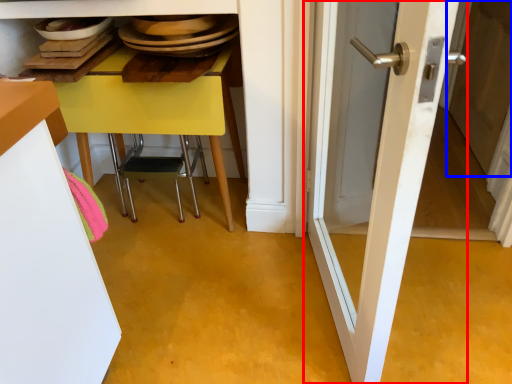
Question: Among these objects, which one is nearest to the camera, door (highlighted by a red box) or screen door (highlighted by a blue box)?

Choices:
 (A) door
 (B) screen door

Answer: (A)